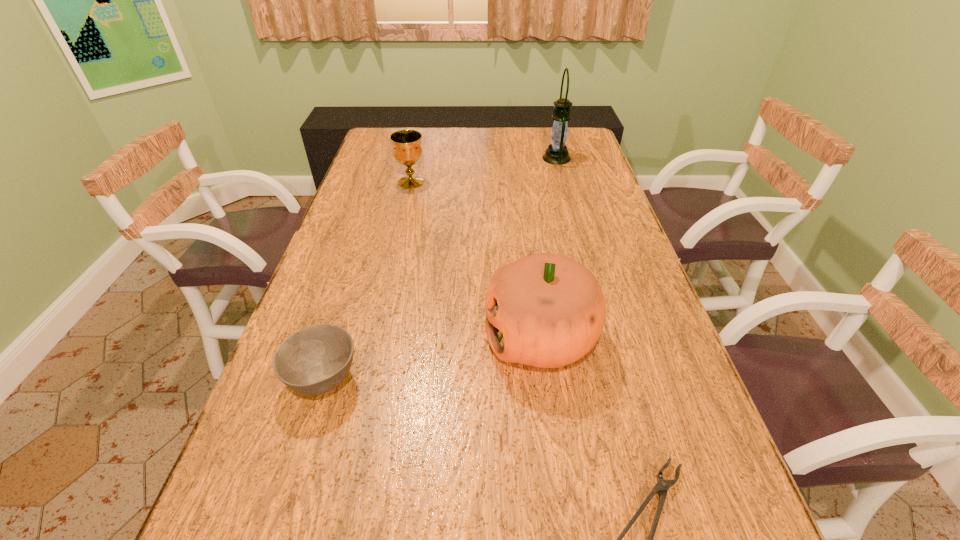
Image resolution: width=960 pixels, height=540 pixels. In order to click on vacant space at the left edge of the desktop in this screenshot , I will do `click(316, 274)`.

At what (x,y) coordinates should I click in order to perform the action: click on free space at the right edge of the desktop. Please return your answer as a coordinate pair (x, y). Looking at the image, I should click on (567, 172).

Locate an element on the screen. This screenshot has width=960, height=540. vacant space in between the chalice and the fourth shortest object is located at coordinates click(x=476, y=260).

Where is `vacant space that's between the lantern and the fourth tallest object`? vacant space that's between the lantern and the fourth tallest object is located at coordinates (441, 269).

The height and width of the screenshot is (540, 960). Identify the location of unoccupied position between the pumpkin and the second farthest object. (476, 260).

I want to click on free space between the second shortest object and the tallest object, so click(441, 269).

I want to click on the second closest object to the pumpkin, so click(312, 361).

The width and height of the screenshot is (960, 540). What are the coordinates of `object that ranks as the second closest to the tongs` in the screenshot? It's located at click(x=312, y=361).